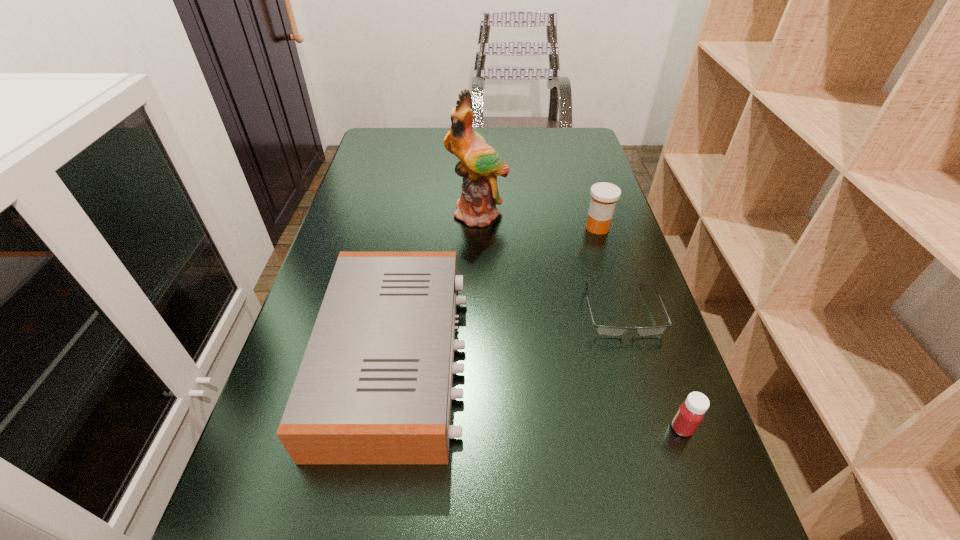
Locate an element on the screen. Image resolution: width=960 pixels, height=540 pixels. empty space that is in between the taller medicine and the parrot is located at coordinates (538, 221).

I want to click on free space between the tallest object and the shorter medicine, so click(580, 321).

This screenshot has width=960, height=540. I want to click on blank region between the spectacles and the parrot, so click(x=549, y=262).

Identify the location of free spot between the radio receiver and the shorter medicine. The image size is (960, 540). (539, 394).

Locate an element on the screen. unoccupied position between the spectacles and the shorter medicine is located at coordinates (651, 369).

You are a GUI agent. You are given a task and a screenshot of the screen. Output one action in this format:
    pyautogui.click(x=<x>, y=<y>)
    Task: Click on the free point between the radio receiver and the nearer medicine
    This screenshot has height=540, width=960.
    Given the screenshot: What is the action you would take?
    [x=539, y=394]

Select which object appears as the third closest to the nearer medicine. Please provide its 2D coordinates. Your answer should be formatted as a tuple, i.e. [(x, y)], where the tuple contains the x and y coordinates of a point satisfying the conditions above.

[(604, 196)]

Point out which object is positioned as the fourth nearest to the farther medicine. Please provide its 2D coordinates. Your answer should be formatted as a tuple, i.e. [(x, y)], where the tuple contains the x and y coordinates of a point satisfying the conditions above.

[(690, 414)]

At what (x,y) coordinates should I click in order to perform the action: click on free location that satisfies the following two spatial constraints: 1. on the back side of the nearer medicine; 2. on the control panel of the radio receiver. Please return your answer as a coordinate pair (x, y). Looking at the image, I should click on (658, 359).

At what (x,y) coordinates should I click in order to perform the action: click on free spot that satisfies the following two spatial constraints: 1. on the front-facing side of the tallest object; 2. on the control panel of the radio receiver. Please return your answer as a coordinate pair (x, y). Image resolution: width=960 pixels, height=540 pixels. Looking at the image, I should click on (477, 359).